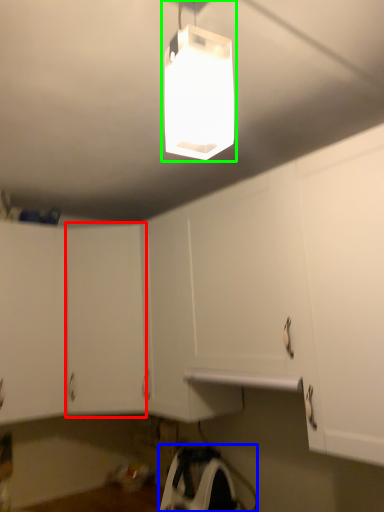
Question: Based on their relative distances, which object is farther from cabinetry (highlighted by a red box)? Choose from appliance (highlighted by a blue box) and lamp (highlighted by a green box).

Choices:
 (A) appliance
 (B) lamp

Answer: (B)